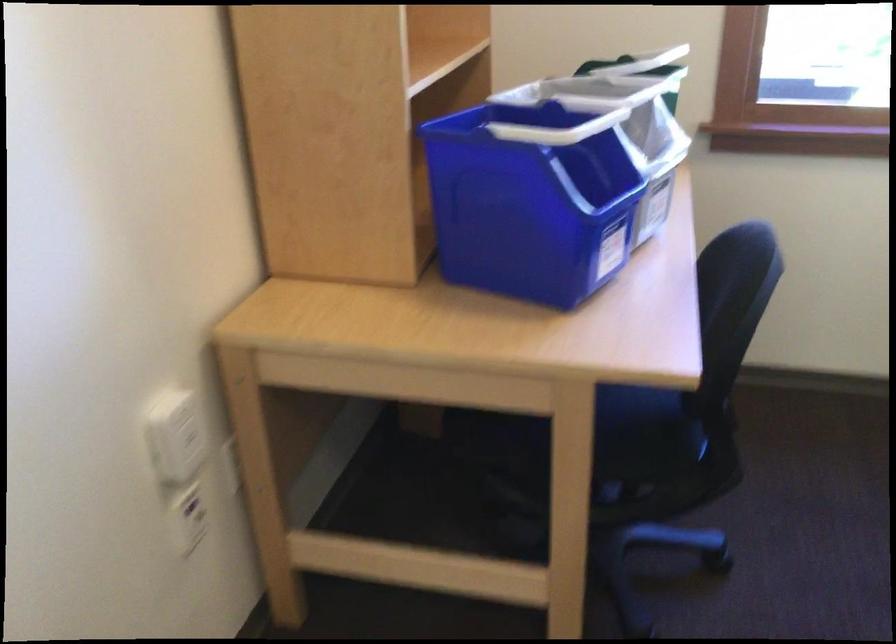
The image size is (896, 644). Describe the element at coordinates (625, 469) in the screenshot. I see `the chair armrest` at that location.